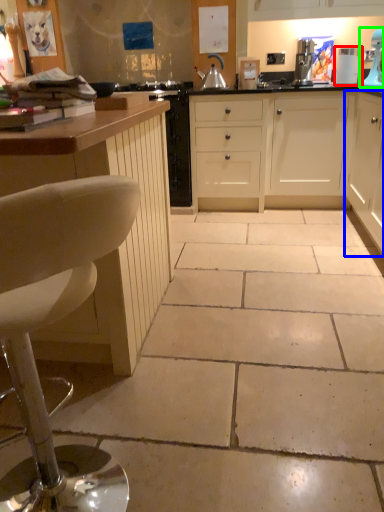
Question: Based on their relative distances, which object is farther from appliance (highlighted by a red box)? Choose from cabinetry (highlighted by a blue box) and home appliance (highlighted by a green box).

Choices:
 (A) cabinetry
 (B) home appliance

Answer: (A)